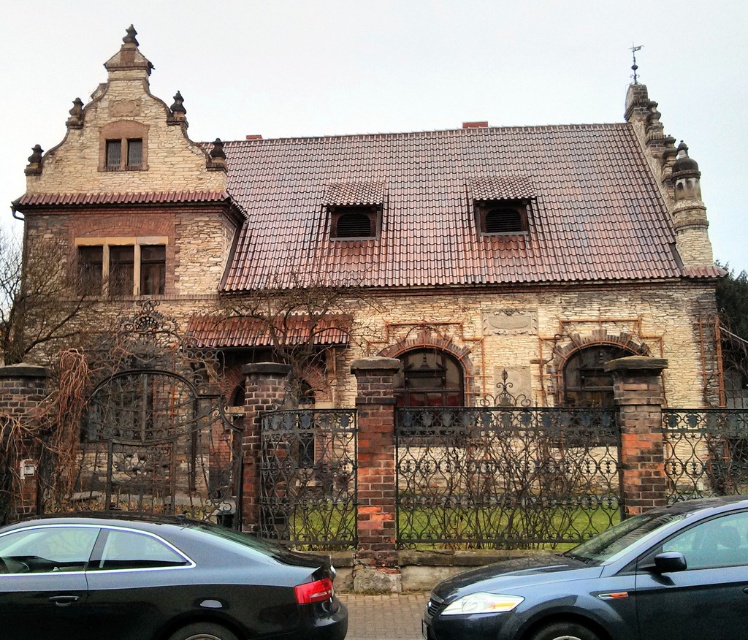
You are standing in front of the historic building and want to determine the relative positions of two points marked on its facade. Specifically, you need to know which point is closer to you. The points are labeled as point (159, 563) and point (628, 588). Based on the building structure described, which point is nearer to your current position?

Point (159, 563) is closer to you than point (628, 588) because it is further to the viewer according to the description.